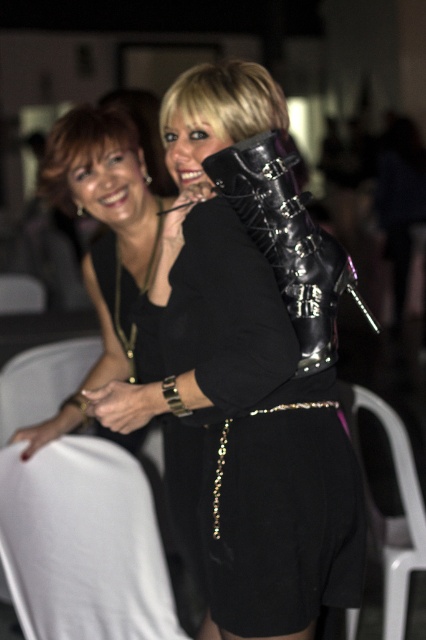
Who is positioned more to the right, black leather dress at center or matte black hair at upper left?

From the viewer's perspective, black leather dress at center appears more on the right side.

Does black leather dress at center have a lesser height compared to matte black hair at upper left?

No.

Is point (264, 568) farther from viewer compared to point (131, 140)?

No, it is not.

Identify the location of black leather dress at center. This screenshot has height=640, width=426. (259, 436).

Between shiny black boot at center and matte black dress at upper center, which one has less height?

matte black dress at upper center is shorter.

Is shiny black boot at center smaller than matte black dress at upper center?

No.

Between point (284, 195) and point (181, 84), which one is positioned in front?

Point (284, 195)

At what (x,y) coordinates should I click in order to perform the action: click on shiny black boot at center. Please return your answer as a coordinate pair (x, y). Image resolution: width=426 pixels, height=640 pixels. Looking at the image, I should click on (287, 241).

Is black leather dress at center to the left of white plastic chair at lower right from the viewer's perspective?

Yes, black leather dress at center is to the left of white plastic chair at lower right.

Does point (342, 595) come farther from viewer compared to point (370, 502)?

No, (342, 595) is in front of (370, 502).

The height and width of the screenshot is (640, 426). Describe the element at coordinates (259, 436) in the screenshot. I see `black leather dress at center` at that location.

Identify the location of black leather dress at center. (259, 436).